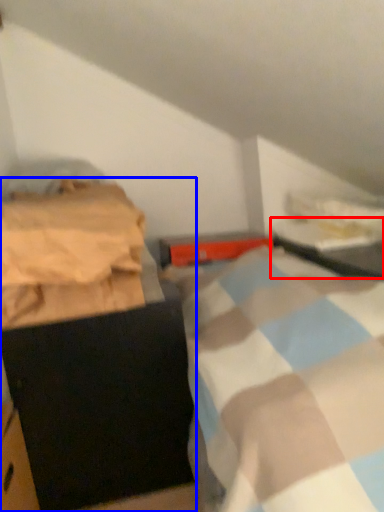
Question: Which of the following is the farthest to the observer, table (highlighted by a red box) or furniture (highlighted by a blue box)?

Choices:
 (A) table
 (B) furniture

Answer: (A)